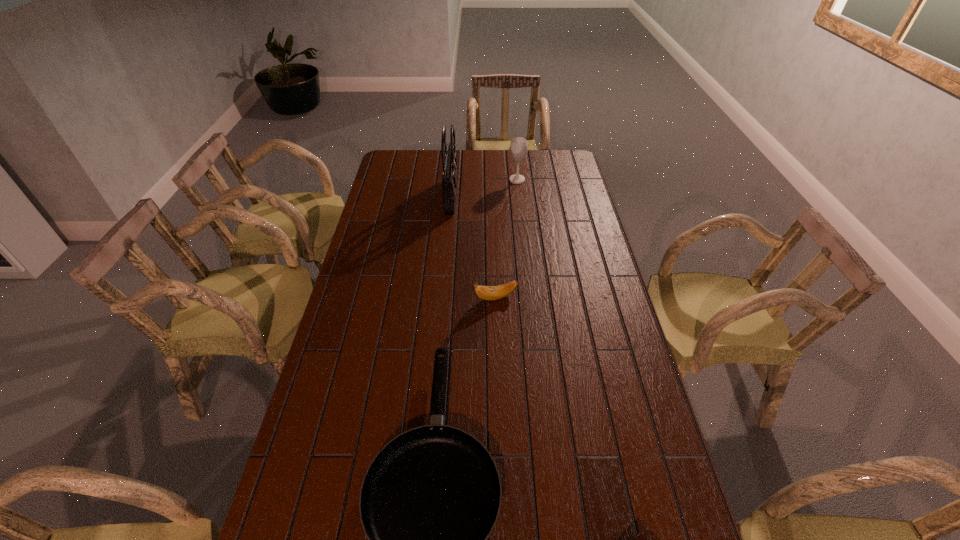
Identify the location of handbag. Image resolution: width=960 pixels, height=540 pixels. (449, 174).

Where is `wineglass`? This screenshot has height=540, width=960. wineglass is located at coordinates (519, 146).

I want to click on the third nearest object, so click(484, 292).

Find the location of a particular element. This screenshot has width=960, height=540. banana is located at coordinates (484, 292).

The image size is (960, 540). I want to click on blank area located with an open clasp on the front of the tallest object, so [x=535, y=195].

You are a GUI agent. You are given a task and a screenshot of the screen. Output one action in this format:
    pyautogui.click(x=<x>, y=<y>)
    Task: Click on the free spot located 0.090m on the right of the wineglass
    The height and width of the screenshot is (540, 960).
    Given the screenshot: What is the action you would take?
    pyautogui.click(x=544, y=180)

You are a GUI agent. You are given a task and a screenshot of the screen. Output one action in this format:
    pyautogui.click(x=<x>, y=<y>)
    Task: Click on the free space located on the front of the third nearest object
    The image size is (960, 540).
    Given the screenshot: What is the action you would take?
    pyautogui.click(x=500, y=415)

The height and width of the screenshot is (540, 960). In order to click on vacant space at the far edge of the desktop in this screenshot , I will do `click(501, 169)`.

Where is `vacant region at the left edge of the desktop`? vacant region at the left edge of the desktop is located at coordinates (396, 177).

In order to click on vacant space at the right edge of the desktop in this screenshot , I will do `click(570, 232)`.